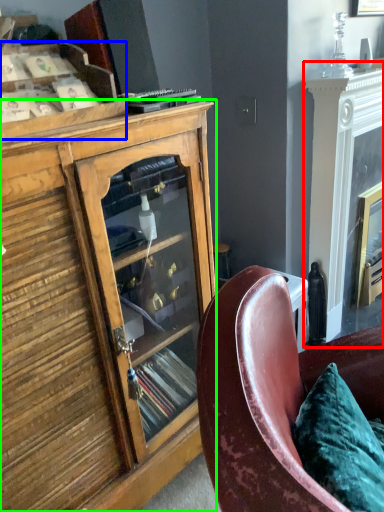
Question: Which is farther away from fireplace (highlighted by a red box)? shelf (highlighted by a blue box) or cabinetry (highlighted by a green box)?

Choices:
 (A) shelf
 (B) cabinetry

Answer: (A)